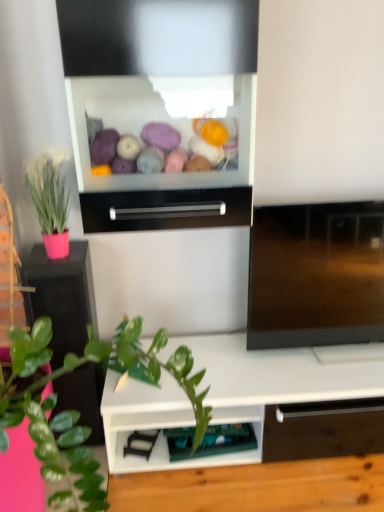
Question: Can black glossy drawer at center be found inside matte pink pot at left?

Choices:
 (A) yes
 (B) no

Answer: (B)

Question: Does matte pink pot at left have a greater width compared to black glossy drawer at center?

Choices:
 (A) yes
 (B) no

Answer: (A)

Question: Does matte pink pot at left lie behind black glossy drawer at center?

Choices:
 (A) yes
 (B) no

Answer: (A)

Question: Does matte pink pot at left turn towards black glossy drawer at center?

Choices:
 (A) no
 (B) yes

Answer: (A)

Question: From a real-world perspective, is matte pink pot at left positioned over black glossy drawer at center based on gravity?

Choices:
 (A) no
 (B) yes

Answer: (B)

Question: Is matte pink pot at left positioned beyond the bounds of black glossy drawer at center?

Choices:
 (A) no
 (B) yes

Answer: (B)

Question: Is pink matte plant pot at left beside green plastic shelf at lower center?

Choices:
 (A) no
 (B) yes

Answer: (A)

Question: From the image's perspective, is pink matte plant pot at left located beneath green plastic shelf at lower center?

Choices:
 (A) yes
 (B) no

Answer: (B)

Question: Is pink matte plant pot at left positioned behind green plastic shelf at lower center?

Choices:
 (A) no
 (B) yes

Answer: (A)

Question: Is pink matte plant pot at left aimed at green plastic shelf at lower center?

Choices:
 (A) no
 (B) yes

Answer: (A)

Question: Can you confirm if pink matte plant pot at left is thinner than green plastic shelf at lower center?

Choices:
 (A) no
 (B) yes

Answer: (A)

Question: Considering the relative sizes of pink matte plant pot at left and green plastic shelf at lower center in the image provided, is pink matte plant pot at left wider than green plastic shelf at lower center?

Choices:
 (A) yes
 (B) no

Answer: (A)

Question: Considering the relative sizes of matte pink pot at left and green plastic shelf at lower center in the image provided, is matte pink pot at left smaller than green plastic shelf at lower center?

Choices:
 (A) yes
 (B) no

Answer: (B)